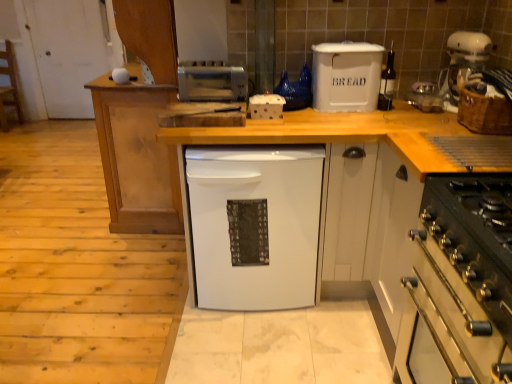
At what (x,y) coordinates should I click in order to perform the action: click on vacant space to the left of white plastic coffee machine at upper right. Please return your answer as a coordinate pair (x, y). Image resolution: width=512 pixels, height=384 pixels. Looking at the image, I should click on (407, 112).